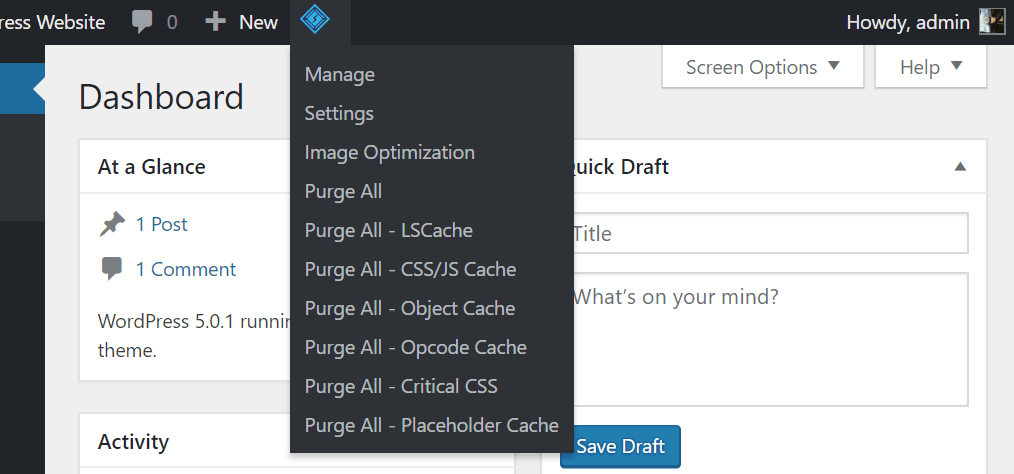
In order to click on thumbtack in this screenshot , I will do `click(105, 226)`.